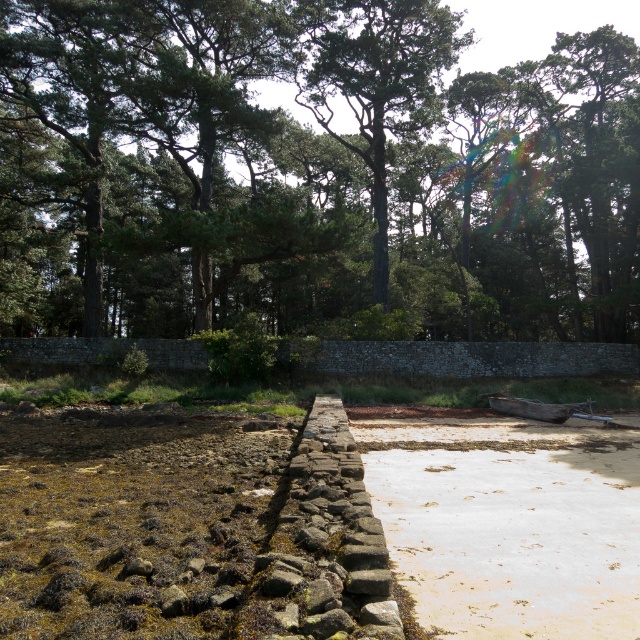
Is green leafy trees at upper center closer to camera compared to weathered wood canoe at center?

No, it is behind weathered wood canoe at center.

Describe the element at coordinates (310, 172) in the screenshot. The width and height of the screenshot is (640, 640). I see `green leafy trees at upper center` at that location.

Does point (600, 38) come behind point (518, 413)?

Yes.

Find the location of a particular element. green leafy trees at upper center is located at coordinates (310, 172).

Between smooth concrete path at center and green textured tree at center, which one has less height?

smooth concrete path at center is shorter.

Is smooth concrete path at center bigger than green textured tree at center?

No, smooth concrete path at center is not bigger than green textured tree at center.

Locate an element on the screen. The image size is (640, 640). smooth concrete path at center is located at coordinates coord(509,522).

This screenshot has height=640, width=640. Describe the element at coordinates (310, 172) in the screenshot. I see `green leafy trees at upper center` at that location.

Can you confirm if green leafy trees at upper center is bigger than smooth concrete path at center?

Yes.

Does point (529, 257) come in front of point (534, 492)?

No, it is not.

The image size is (640, 640). I want to click on green leafy trees at upper center, so click(310, 172).